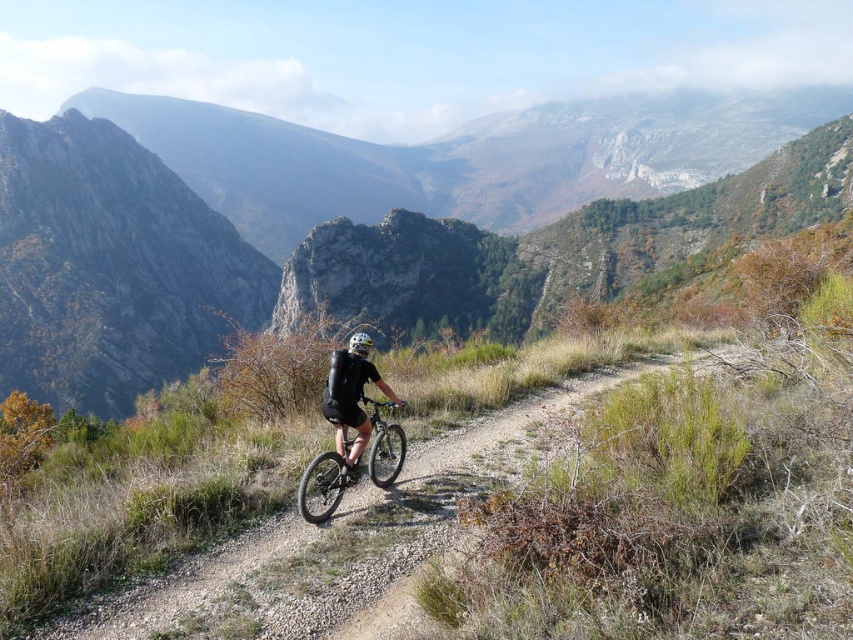
Can you confirm if rugged stone mountain at center is shorter than shiny metallic bicycle at center?

No, rugged stone mountain at center is not shorter than shiny metallic bicycle at center.

Which is in front, point (643, 147) or point (376, 404)?

Point (376, 404)

Is point (1, 292) farther from viewer compared to point (331, 513)?

Yes, it is.

The height and width of the screenshot is (640, 853). I want to click on rugged stone mountain at center, so click(291, 209).

Does rugged stone mountain at center have a greater width compared to black matte shorts at center?

Indeed, rugged stone mountain at center has a greater width compared to black matte shorts at center.

Can you confirm if rugged stone mountain at center is thinner than black matte shorts at center?

No, rugged stone mountain at center is not thinner than black matte shorts at center.

Is point (410, 196) in front of point (334, 381)?

No, (410, 196) is behind (334, 381).

At what (x,y) coordinates should I click in order to perform the action: click on rugged stone mountain at center. Please return your answer as a coordinate pair (x, y). This screenshot has height=640, width=853. Looking at the image, I should click on point(291,209).

Does shiny metallic bicycle at center lie in front of black matte shorts at center?

No.

Between point (326, 458) and point (354, 365), which one is positioned behind?

The point (354, 365) is behind.

Which is behind, point (305, 476) or point (355, 337)?

The point (355, 337) is behind.

Where is `shiny metallic bicycle at center`? The image size is (853, 640). shiny metallic bicycle at center is located at coordinates (323, 484).